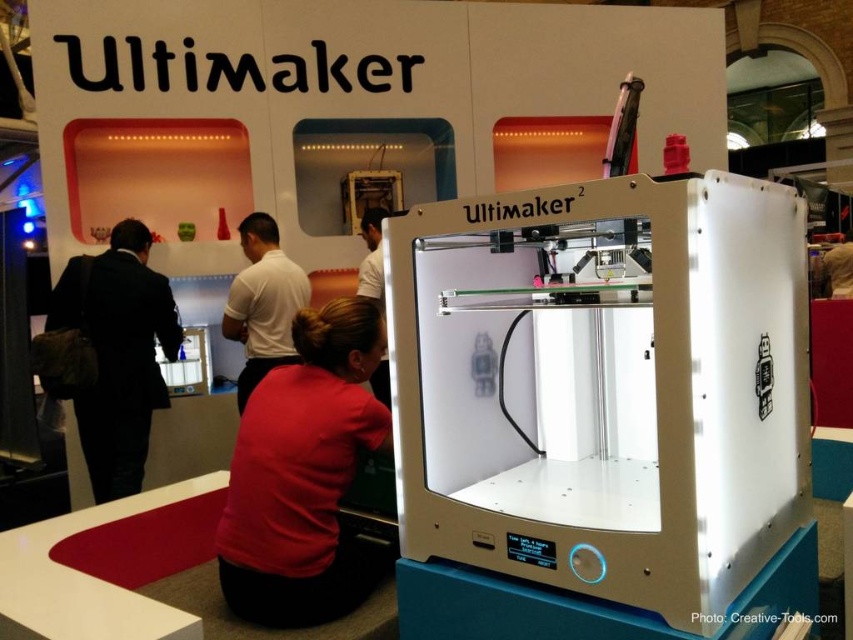
Is red matte shirt at lower center further to the viewer compared to black suit at left?

That is False.

Is point (279, 460) positioned in front of point (82, 428)?

That is True.

In order to click on red matte shirt at lower center in this screenshot , I will do `click(305, 474)`.

Is black suit at left below white shirt at center?

Yes.

Is black suit at left wider than white shirt at center?

Yes, black suit at left is wider than white shirt at center.

Where is `black suit at left`? This screenshot has height=640, width=853. black suit at left is located at coordinates (120, 355).

Find the location of a particular element. black suit at left is located at coordinates (120, 355).

Between red matte shirt at lower center and white shirt at center, which one has less height?

Standing shorter between the two is red matte shirt at lower center.

Image resolution: width=853 pixels, height=640 pixels. I want to click on red matte shirt at lower center, so click(305, 474).